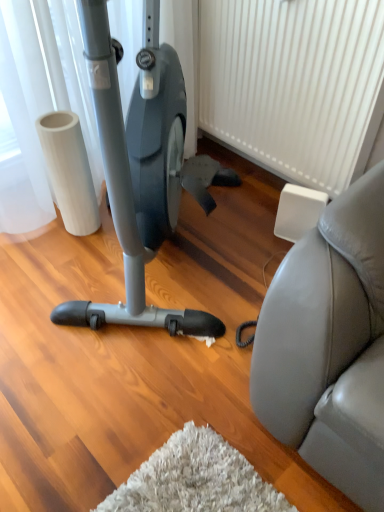
The width and height of the screenshot is (384, 512). What are the coordinates of `free point below matte black stationary bicycle at center (from a real-world perspective)` in the screenshot? It's located at (160, 260).